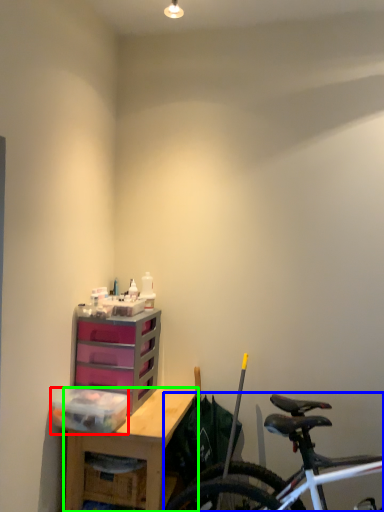
Question: Which object is the closest to the storage box (highlighted by a red box)? Choose among these: bicycle (highlighted by a blue box) or desk (highlighted by a green box).

Choices:
 (A) bicycle
 (B) desk

Answer: (B)